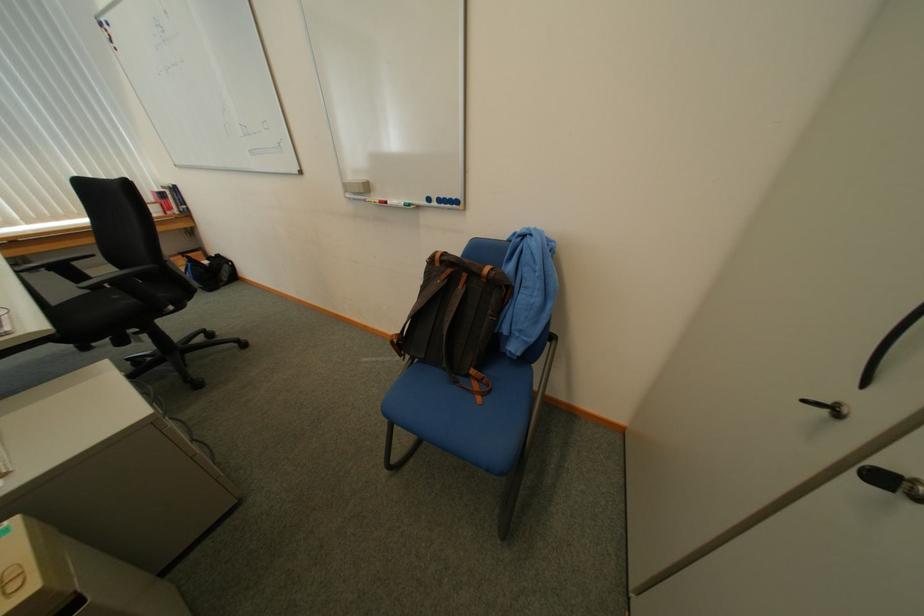
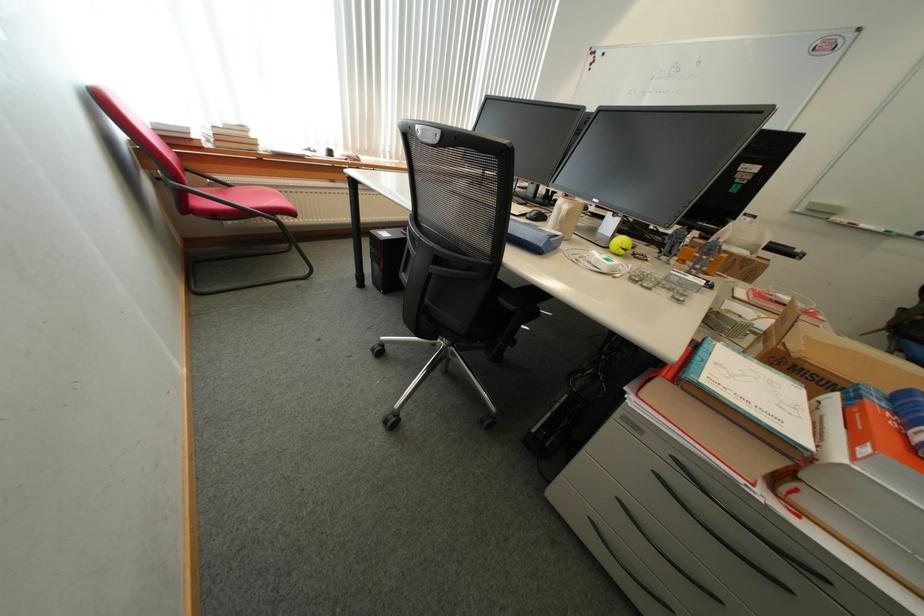
Find the pixel in the second image that matches [396,204] in the first image.

(861, 225)